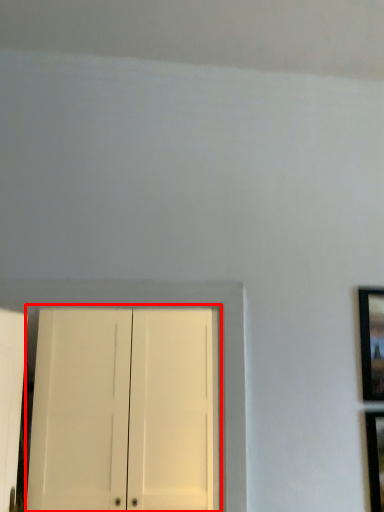
Question: From the image's perspective, where is door (annotated by the red box) located relative to picture frame?

Choices:
 (A) above
 (B) below

Answer: (B)